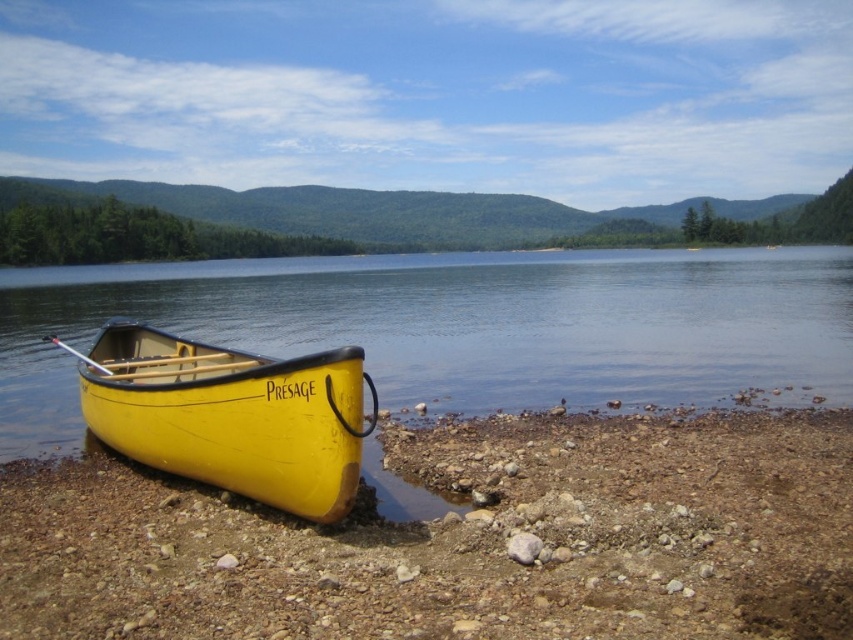
Question: Which object is farther from the camera taking this photo?

Choices:
 (A) yellow wood canoe at lower left
 (B) yellow wood water at lower left
 (C) yellow matte wood canoe at lower left

Answer: (B)

Question: Which of the following is the farthest from the observer?

Choices:
 (A) (181, 428)
 (B) (244, 532)
 (C) (454, 301)

Answer: (C)

Question: Does yellow wood water at lower left have a greater width compared to yellow matte wood canoe at lower left?

Choices:
 (A) yes
 (B) no

Answer: (A)

Question: Based on their relative distances, which object is nearer to the yellow wood canoe at lower left?

Choices:
 (A) yellow matte wood canoe at lower left
 (B) yellow wood water at lower left

Answer: (A)

Question: Observing the image, what is the correct spatial positioning of yellow wood water at lower left in reference to yellow matte wood canoe at lower left?

Choices:
 (A) below
 (B) above

Answer: (B)

Question: Is yellow wood canoe at lower left thinner than yellow matte wood canoe at lower left?

Choices:
 (A) no
 (B) yes

Answer: (B)